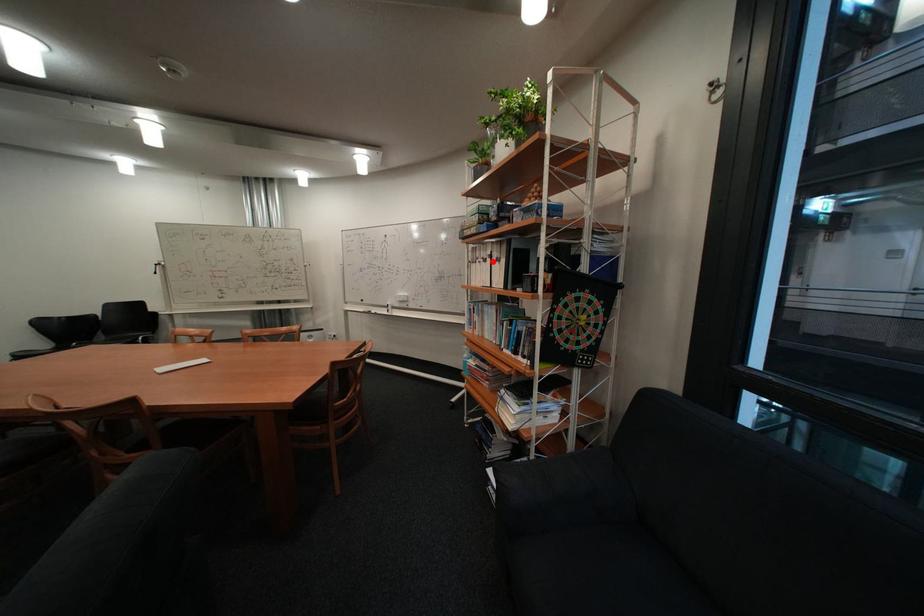
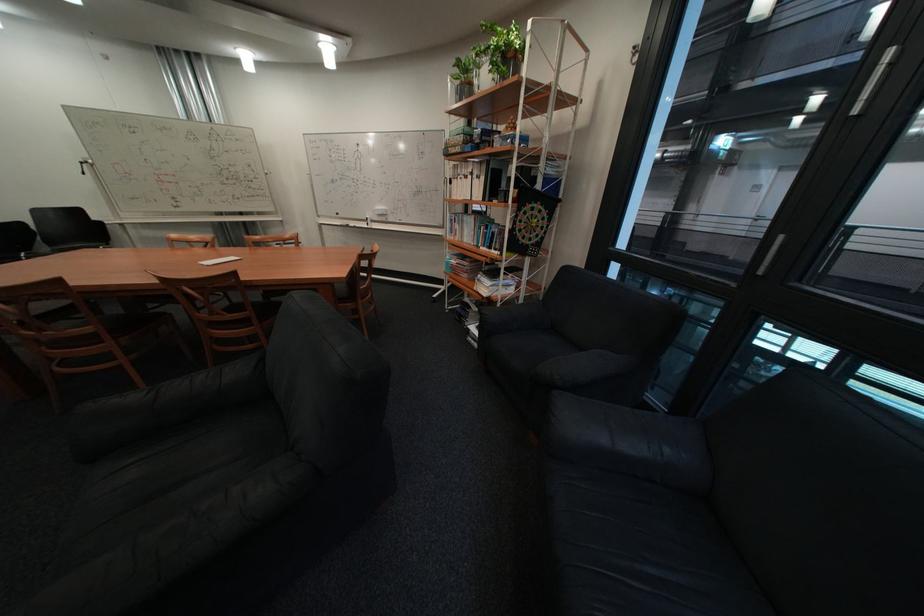
Question: I am providing you with two images of the same scene from different viewpoints. A red point is shown in image1. For the corresponding object point in image2, is it positioned nearer or farther from the camera?

Choices:
 (A) Nearer
 (B) Farther

Answer: (A)